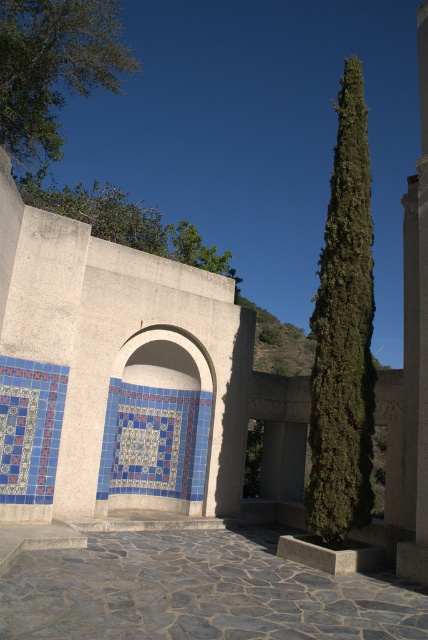
Question: In this image, where is gray stone courtyard at center located relative to blue mosaic tile arch at center?

Choices:
 (A) above
 (B) below

Answer: (B)

Question: Which point is closer to the camera taking this photo?

Choices:
 (A) (410, 465)
 (B) (143, 570)
 (C) (62, 140)

Answer: (B)

Question: Can you confirm if blue mosaic tile arch at center is smaller than green leafy tree at upper left?

Choices:
 (A) no
 (B) yes

Answer: (A)

Question: Can you confirm if green leafy tree at upper left is smaller than white stone pillar at right?

Choices:
 (A) no
 (B) yes

Answer: (B)

Question: Which point is farther from the camera taking this photo?

Choices:
 (A) (332, 412)
 (B) (30, 93)
 (C) (145, 209)
 (D) (142, 365)

Answer: (C)

Question: Which of the following is the closest to the observer?

Choices:
 (A) (416, 492)
 (B) (193, 244)
 (C) (149, 416)
 (D) (294, 609)

Answer: (D)